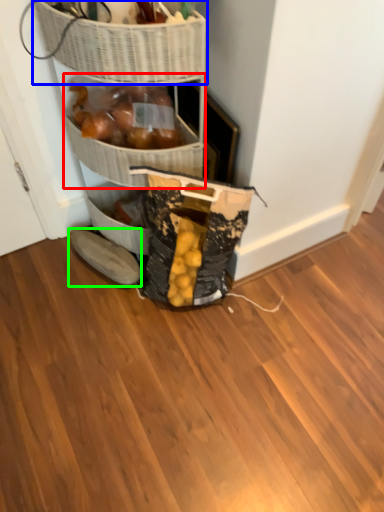
Question: Estimate the real-world distances between objects in this image. Which object is closer to basket (highlighted by a red box), basket (highlighted by a blue box) or footwear (highlighted by a green box)?

Choices:
 (A) basket
 (B) footwear

Answer: (A)